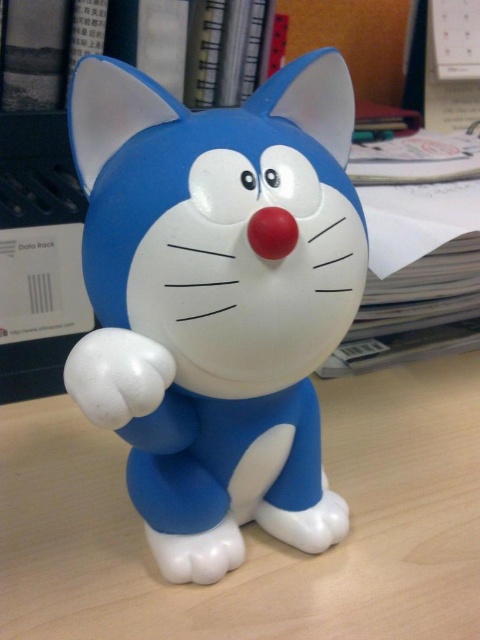
Question: Does blue matte plastic cat at center have a greater width compared to white matte computer desk at center?

Choices:
 (A) no
 (B) yes

Answer: (A)

Question: Which of these objects is positioned closest to the white matte computer desk at center?

Choices:
 (A) blue matte plastic cat at center
 (B) matte plastic bookshelf at upper center

Answer: (A)

Question: Does blue matte plastic cat at center have a lesser width compared to white matte computer desk at center?

Choices:
 (A) no
 (B) yes

Answer: (B)

Question: Can you confirm if blue matte plastic cat at center is positioned above matte plastic bookshelf at upper center?

Choices:
 (A) no
 (B) yes

Answer: (A)

Question: Estimate the real-world distances between objects in this image. Which object is closer to the matte plastic bookshelf at upper center?

Choices:
 (A) blue matte plastic cat at center
 (B) white matte computer desk at center

Answer: (A)

Question: Which of the following is the closest to the observer?

Choices:
 (A) (109, 134)
 (B) (66, 141)

Answer: (A)